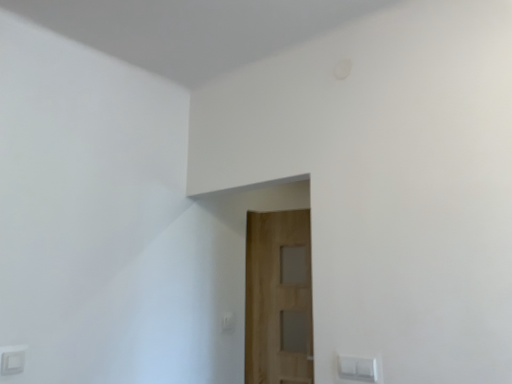
Question: From the image's perspective, is wooden door at center located above white plastic light switch at lower center?

Choices:
 (A) no
 (B) yes

Answer: (B)

Question: Could you tell me if wooden door at center is turned towards white plastic light switch at lower center?

Choices:
 (A) no
 (B) yes

Answer: (B)

Question: Is wooden door at center positioned in front of white plastic light switch at lower center?

Choices:
 (A) yes
 (B) no

Answer: (A)

Question: Considering the relative sizes of wooden door at center and white plastic light switch at lower center in the image provided, is wooden door at center taller than white plastic light switch at lower center?

Choices:
 (A) no
 (B) yes

Answer: (B)

Question: Does wooden door at center appear on the right side of white plastic light switch at lower center?

Choices:
 (A) yes
 (B) no

Answer: (A)

Question: Can you confirm if wooden door at center is positioned to the left of white plastic light switch at lower center?

Choices:
 (A) yes
 (B) no

Answer: (B)

Question: Is white plastic light switch at lower center oriented away from wooden door at center?

Choices:
 (A) yes
 (B) no

Answer: (B)

Question: Is white plastic light switch at lower center far from wooden door at center?

Choices:
 (A) yes
 (B) no

Answer: (B)

Question: Can you confirm if white plastic light switch at lower center is thinner than wooden door at center?

Choices:
 (A) yes
 (B) no

Answer: (A)

Question: Is white plastic light switch at lower center oriented towards wooden door at center?

Choices:
 (A) no
 (B) yes

Answer: (A)

Question: From a real-world perspective, is white plastic light switch at lower center positioned under wooden door at center based on gravity?

Choices:
 (A) yes
 (B) no

Answer: (A)

Question: Does white plastic light switch at lower center lie behind wooden door at center?

Choices:
 (A) yes
 (B) no

Answer: (A)

Question: Which is correct: wooden door at center is inside white plastic light switch at lower center, or outside of it?

Choices:
 (A) inside
 (B) outside

Answer: (B)